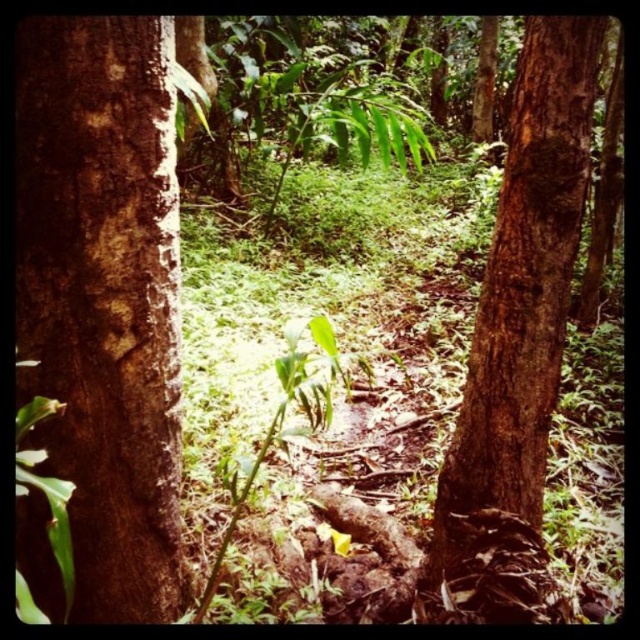
You are standing on the forest path between the two brown rough bark at left and brown rough tree trunk at right. Which tree is closer to you?

The brown rough bark at left is closer to the viewer than the brown rough tree trunk at right.

You are a hiker standing at the center of the forest path. You notice the brown rough bark at left. Based on its coordinates, can you determine if it is located to your left or right side?

The brown rough bark at left is located at coordinates point (104,298), which places it to your left side.